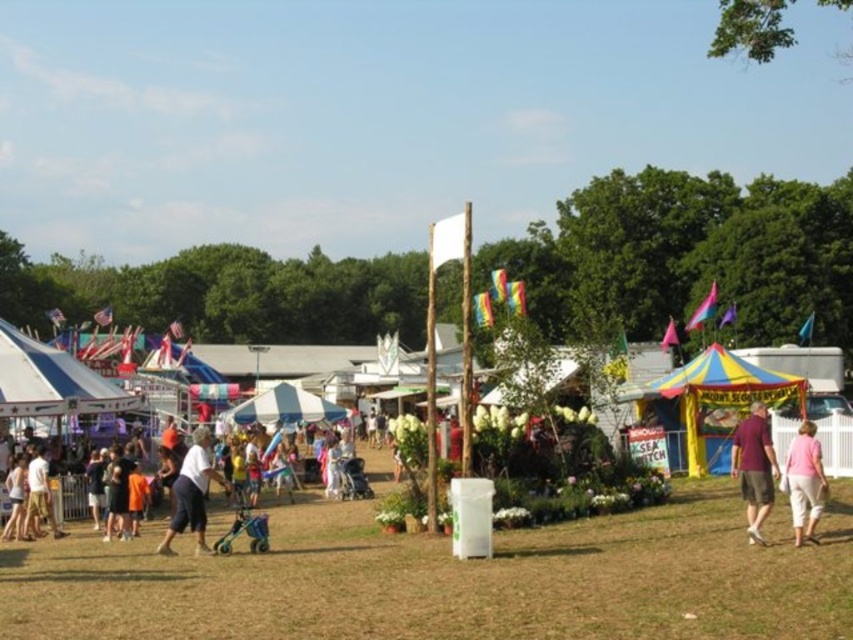
Is white fabric canopy at left to the left of light blue cotton shirt at center from the viewer's perspective?

Correct, you'll find white fabric canopy at left to the left of light blue cotton shirt at center.

Does white fabric canopy at left appear on the right side of light blue cotton shirt at center?

In fact, white fabric canopy at left is to the left of light blue cotton shirt at center.

This screenshot has height=640, width=853. I want to click on white fabric canopy at left, so click(x=51, y=380).

In the scene shown: Can you confirm if maroon fabric shirt at center-right is positioned below light blue cotton shirt at center?

No, maroon fabric shirt at center-right is not below light blue cotton shirt at center.

Is point (766, 461) closer to viewer compared to point (202, 438)?

That is True.

Identify the location of maroon fabric shirt at center-right. (753, 467).

Does maroon fabric shirt at center-right appear over pink cotton shirt at lower right?

No.

Between maroon fabric shirt at center-right and pink cotton shirt at lower right, which one is positioned higher?

pink cotton shirt at lower right

Who is more distant from viewer, [757,432] or [782,468]?

Point [782,468]

At what (x,y) coordinates should I click in order to perform the action: click on maroon fabric shirt at center-right. Please return your answer as a coordinate pair (x, y). This screenshot has width=853, height=640. Looking at the image, I should click on (753, 467).